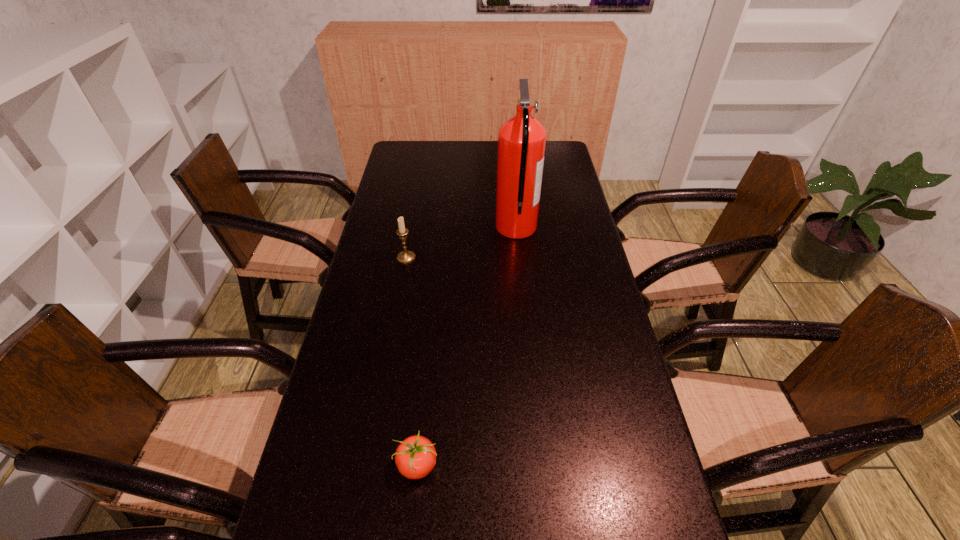
Find the location of a particular element. The height and width of the screenshot is (540, 960). the rightmost object is located at coordinates (521, 139).

Locate an element on the screen. The image size is (960, 540). the farthest object is located at coordinates (521, 139).

Locate an element on the screen. the second farthest object is located at coordinates tap(405, 256).

Where is `candle holder`? The height and width of the screenshot is (540, 960). candle holder is located at coordinates (405, 256).

Where is `the second object from left to right`? Image resolution: width=960 pixels, height=540 pixels. the second object from left to right is located at coordinates (415, 457).

Locate an element on the screen. This screenshot has height=540, width=960. the shortest object is located at coordinates (415, 457).

The height and width of the screenshot is (540, 960). Find the location of `vacant region located 0.330m at the nozzle of the fire extinguisher`. vacant region located 0.330m at the nozzle of the fire extinguisher is located at coordinates (400, 228).

Locate an element on the screen. This screenshot has width=960, height=540. vacant space located at the nozzle of the fire extinguisher is located at coordinates (418, 228).

In order to click on vacant area located 0.300m at the nozzle of the fire extinguisher in this screenshot , I will do `click(409, 228)`.

Find the location of a particular element. Image resolution: width=960 pixels, height=540 pixels. vacant space situated on the back of the second farthest object is located at coordinates (414, 215).